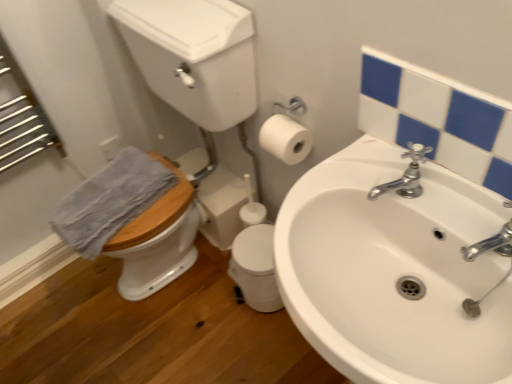
Question: Considering the relative positions of white ceramic sink at center and white glossy mirror at upper right in the image provided, is white ceramic sink at center to the right of white glossy mirror at upper right from the viewer's perspective?

Choices:
 (A) yes
 (B) no

Answer: (B)

Question: Can you confirm if white ceramic sink at center is thinner than white glossy mirror at upper right?

Choices:
 (A) yes
 (B) no

Answer: (B)

Question: Does white ceramic sink at center have a smaller size compared to white glossy mirror at upper right?

Choices:
 (A) no
 (B) yes

Answer: (A)

Question: Does white ceramic sink at center have a greater width compared to white glossy mirror at upper right?

Choices:
 (A) no
 (B) yes

Answer: (B)

Question: Is white ceramic sink at center at the left side of white glossy mirror at upper right?

Choices:
 (A) yes
 (B) no

Answer: (A)

Question: Looking at the image, does white ceramic sink at center seem bigger or smaller compared to white matte toilet paper at upper right?

Choices:
 (A) big
 (B) small

Answer: (A)

Question: Is white ceramic sink at center taller or shorter than white matte toilet paper at upper right?

Choices:
 (A) short
 (B) tall

Answer: (B)

Question: Based on their positions, is white ceramic sink at center located to the left or right of white matte toilet paper at upper right?

Choices:
 (A) right
 (B) left

Answer: (A)

Question: From a real-world perspective, is white ceramic sink at center positioned above or below white matte toilet paper at upper right?

Choices:
 (A) below
 (B) above

Answer: (A)

Question: Considering the positions of point (464, 322) and point (409, 150), is point (464, 322) closer or farther from the camera than point (409, 150)?

Choices:
 (A) farther
 (B) closer

Answer: (B)

Question: From a real-world perspective, is white ceramic sink at center positioned above or below silver metallic faucet at upper right?

Choices:
 (A) above
 (B) below

Answer: (B)

Question: Considering the positions of white ceramic sink at center and silver metallic faucet at upper right in the image, is white ceramic sink at center wider or thinner than silver metallic faucet at upper right?

Choices:
 (A) thin
 (B) wide

Answer: (B)

Question: From their relative heights in the image, would you say white ceramic sink at center is taller or shorter than silver metallic faucet at upper right?

Choices:
 (A) tall
 (B) short

Answer: (A)

Question: Is point (273, 132) closer or farther from the camera than point (420, 162)?

Choices:
 (A) farther
 (B) closer

Answer: (A)

Question: Which is correct: white matte toilet paper at upper right is inside silver metallic faucet at upper right, or outside of it?

Choices:
 (A) outside
 (B) inside

Answer: (A)